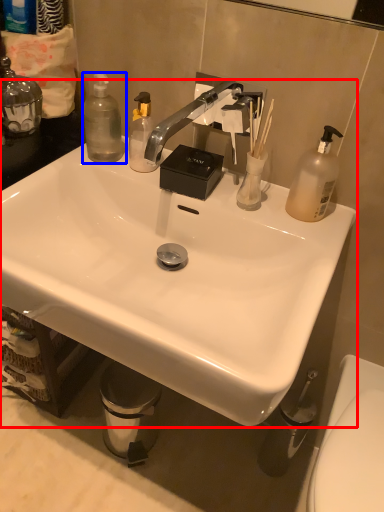
Question: Among these objects, which one is nearest to the camera, sink (highlighted by a red box) or bottle (highlighted by a blue box)?

Choices:
 (A) sink
 (B) bottle

Answer: (A)